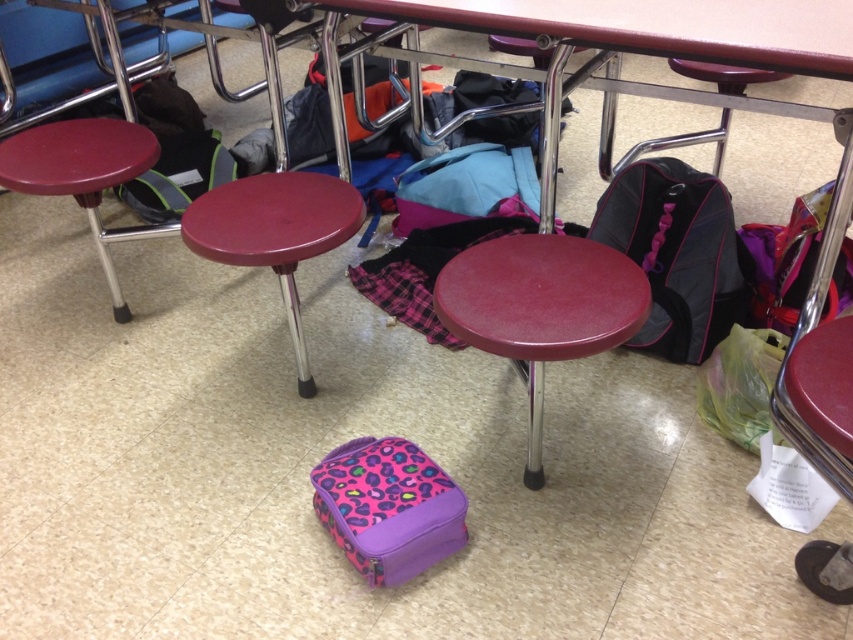
You are organizing the classroom and need to place a new item on the table. The new item requires a space that is not occupied by the black fabric backpack at lower right. Based on the coordinates provided in the description, where should you place the new item to ensure it doesn not interfere with the backpack?

The black fabric backpack at lower right is located at point (676,253). To avoid interference, place the new item in an area of the table not near those coordinates, such as the upper left or center regions.

You are organizing the classroom and need to place a new item on the table. The table is at coordinates ranging from 0.2 to 0.8 on the x and y axes. Is the black fabric backpack at lower right currently within the table area?

The black fabric backpack at lower right is located at point (676, 253), which falls within the table area coordinates of 0.2 to 0.8 on both axes. Therefore, the backpack is on the table.